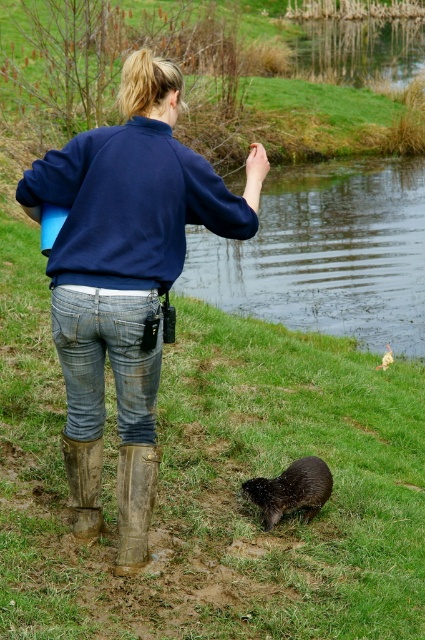
Based on the photo, you are the person in the image. You want to step forward to get closer to the otter. Which object, the green grass at lower center or the muddy rubber boot at lower left, is in front of you and would you step on first?

The green grass at lower center is in front of the muddy rubber boot at lower left. Since you are the person in the image, your muddy rubber boot at lower left is behind the green grass at lower center, so you would step on the green grass at lower center first to move forward toward the otter.

You are standing at the point marked as point (67,173). You want to throw a small pebble to the person in the image. Can you reach them from your current position?

The distance between point (67,173) and the viewer is 3.79 meters. Since the person is within that distance, you can likely reach them by throwing the pebble from your current position.

You are a wildlife photographer trying to capture a closeup of the shiny brown otter at lower center without disturbing it. You are currently standing on the muddy ground and wearing the muddy rubber boot at lower left. If you take a step forward, will the otter still be in frame? Explain your reasoning based on their sizes.

The shiny brown otter at lower center is larger in size than the muddy rubber boot at lower left. Since the otter is bigger, stepping forward might bring it more into focus but could also startle it. However, the size difference alone doesn